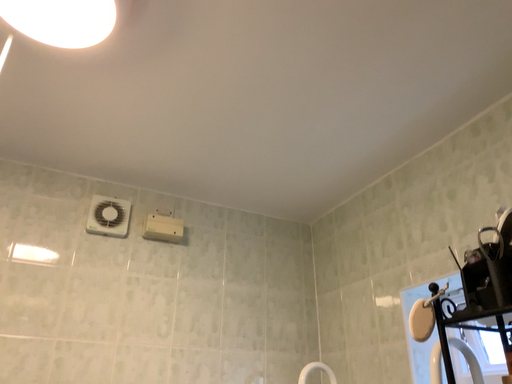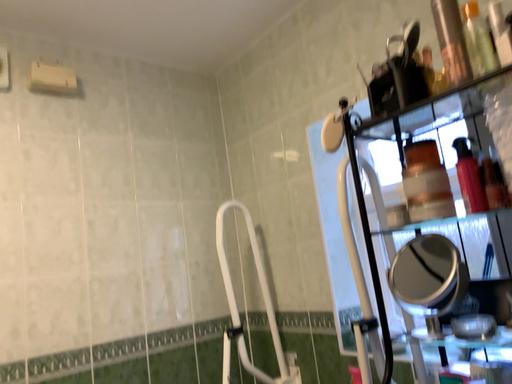
Question: How did the camera likely rotate when shooting the video?

Choices:
 (A) rotated right
 (B) rotated left

Answer: (A)